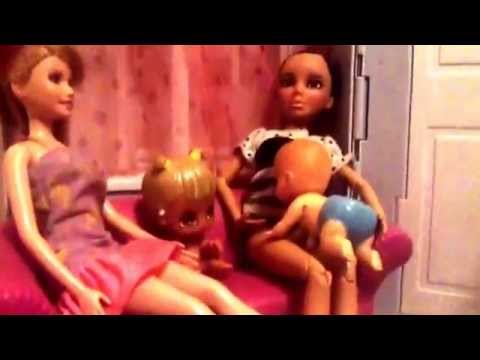
The height and width of the screenshot is (360, 480). I want to click on door hinge, so click(365, 122).